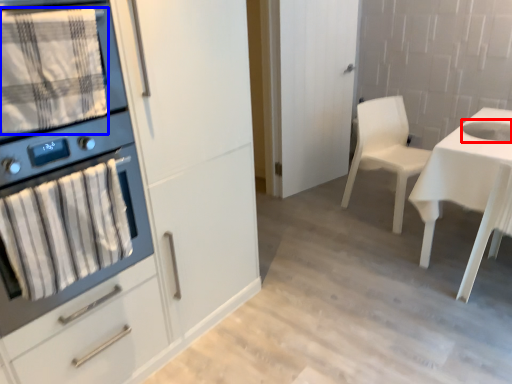
Question: Among these objects, which one is nearest to the camera, sink (highlighted by a red box) or blanket (highlighted by a blue box)?

Choices:
 (A) sink
 (B) blanket

Answer: (B)